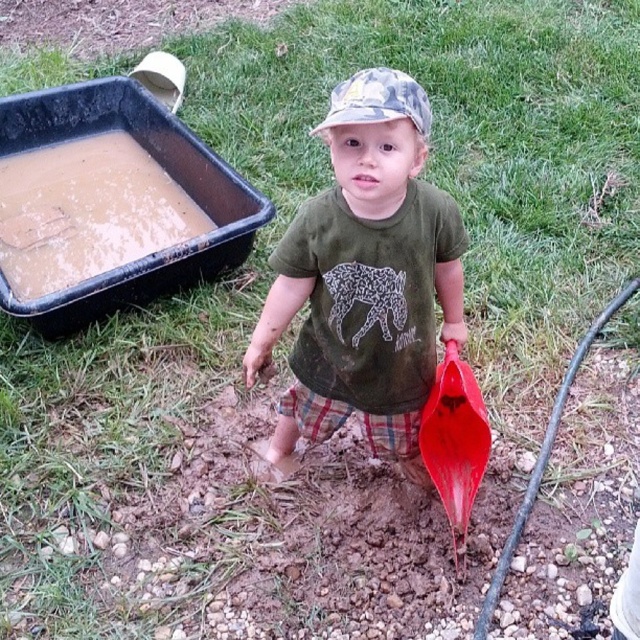
Question: Among these points, which one is farthest from the camera?

Choices:
 (A) (481, 435)
 (B) (372, 102)
 (C) (372, 141)

Answer: (A)

Question: Which point appears farthest from the camera in this image?

Choices:
 (A) coord(467,416)
 (B) coord(378,106)
 (C) coord(342,275)

Answer: (A)

Question: Is the position of green matte shirt at center less distant than that of camouflage fabric cap at center?

Choices:
 (A) no
 (B) yes

Answer: (B)

Question: Can you confirm if green matte shirt at center is positioned below camouflage fabric cap at center?

Choices:
 (A) no
 (B) yes

Answer: (B)

Question: Is green matte shirt at center further to the viewer compared to camouflage fabric cap at center?

Choices:
 (A) no
 (B) yes

Answer: (A)

Question: Which point is closer to the camera taking this photo?

Choices:
 (A) (461, 563)
 (B) (365, 147)

Answer: (B)